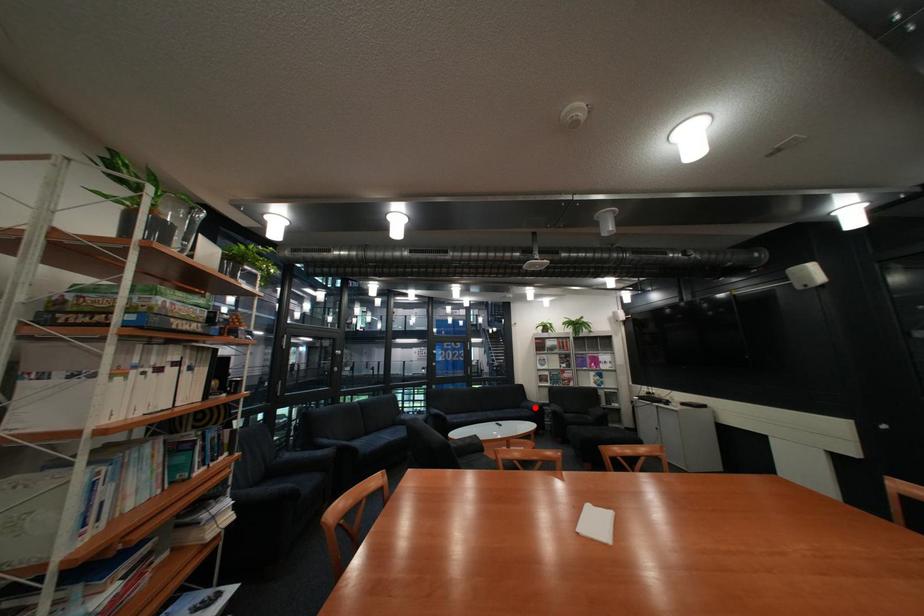
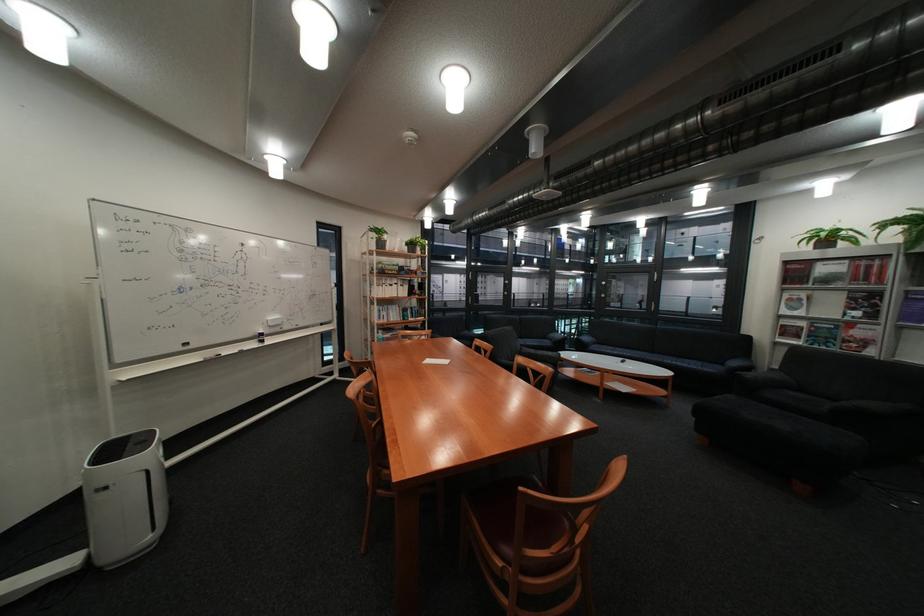
Question: I am providing you with two images of the same scene from different viewpoints. A red point is shown in image1. For the corresponding object point in image2, is it positioned nearer or farther from the camera?

Choices:
 (A) Nearer
 (B) Farther

Answer: (A)